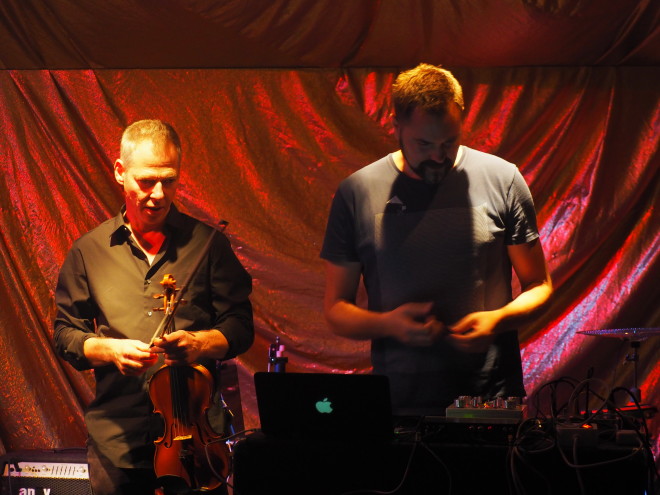
Where is `red curatin`? The height and width of the screenshot is (495, 660). red curatin is located at coordinates (257, 156).